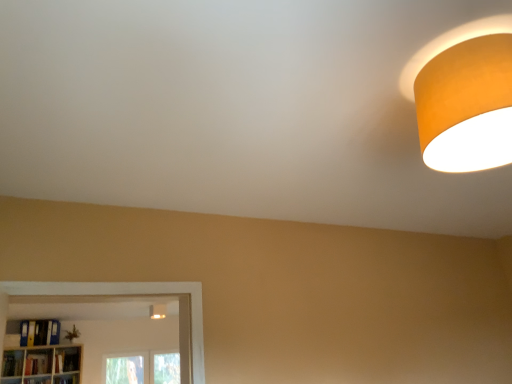
Question: From a real-world perspective, is orange matte lampshade at upper right, the 1th lamp in the front-to-back sequence, physically below hardcover book at lower left, which ranks as the 4th book in left-to-right order?

Choices:
 (A) no
 (B) yes

Answer: (A)

Question: Is orange matte lampshade at upper right, which is the 1th lamp from top to bottom, shorter than hardcover book at lower left, positioned as the first book in right-to-left order?

Choices:
 (A) yes
 (B) no

Answer: (B)

Question: Can you confirm if orange matte lampshade at upper right, the 2th lamp from the left, is taller than hardcover book at lower left, which ranks as the 4th book in left-to-right order?

Choices:
 (A) no
 (B) yes

Answer: (B)

Question: Can you confirm if orange matte lampshade at upper right, which is the 1th lamp from top to bottom, is bigger than hardcover book at lower left, which ranks as the 4th book in left-to-right order?

Choices:
 (A) yes
 (B) no

Answer: (A)

Question: Considering the relative sizes of orange matte lampshade at upper right, arranged as the second lamp when viewed from the back, and hardcover book at lower left, positioned as the first book in right-to-left order, in the image provided, is orange matte lampshade at upper right, arranged as the second lamp when viewed from the back, wider than hardcover book at lower left, positioned as the first book in right-to-left order,?

Choices:
 (A) no
 (B) yes

Answer: (B)

Question: Considering the relative positions of orange matte lampshade at upper right, arranged as the second lamp when viewed from the back, and wooden bookshelf at lower left, arranged as the second shelf when viewed from the left, in the image provided, is orange matte lampshade at upper right, arranged as the second lamp when viewed from the back, to the left or to the right of wooden bookshelf at lower left, arranged as the second shelf when viewed from the left,?

Choices:
 (A) right
 (B) left

Answer: (A)

Question: In terms of height, does orange matte lampshade at upper right, which is the 1th lamp in right-to-left order, look taller or shorter compared to wooden bookshelf at lower left, arranged as the second shelf when viewed from the left?

Choices:
 (A) tall
 (B) short

Answer: (A)

Question: In the image, is orange matte lampshade at upper right, which is the 1th lamp from top to bottom, positioned in front of or behind wooden bookshelf at lower left, arranged as the second shelf when viewed from the left?

Choices:
 (A) front
 (B) behind

Answer: (A)

Question: Looking at the image, does orange matte lampshade at upper right, which is the 1th lamp from top to bottom, seem bigger or smaller compared to wooden bookshelf at lower left, arranged as the second shelf when viewed from the left?

Choices:
 (A) small
 (B) big

Answer: (B)

Question: From a real-world perspective, is hardcover book at lower left, positioned as the first book in right-to-left order, physically located above or below wooden bookshelf at lower left, the second shelf positioned from the right?

Choices:
 (A) above
 (B) below

Answer: (A)

Question: Is point (61, 352) positioned closer to the camera than point (29, 377)?

Choices:
 (A) farther
 (B) closer

Answer: (A)

Question: In the image, is hardcover book at lower left, which ranks as the 4th book in left-to-right order, on the left side or the right side of wooden bookshelf at lower left, the second shelf positioned from the right?

Choices:
 (A) left
 (B) right

Answer: (B)

Question: Is hardcover book at lower left, which ranks as the 4th book in left-to-right order, taller or shorter than wooden bookshelf at lower left, the second shelf positioned from the right?

Choices:
 (A) tall
 (B) short

Answer: (A)

Question: Which is correct: hardcover book at lower left, which is the 3th book from right to left, is inside wooden bookshelf at lower left, arranged as the second shelf when viewed from the left, or outside of it?

Choices:
 (A) inside
 (B) outside

Answer: (B)

Question: Looking at their shapes, would you say hardcover book at lower left, which is the 2th book in left-to-right order, is wider or thinner than wooden bookshelf at lower left, arranged as the second shelf when viewed from the left?

Choices:
 (A) thin
 (B) wide

Answer: (A)